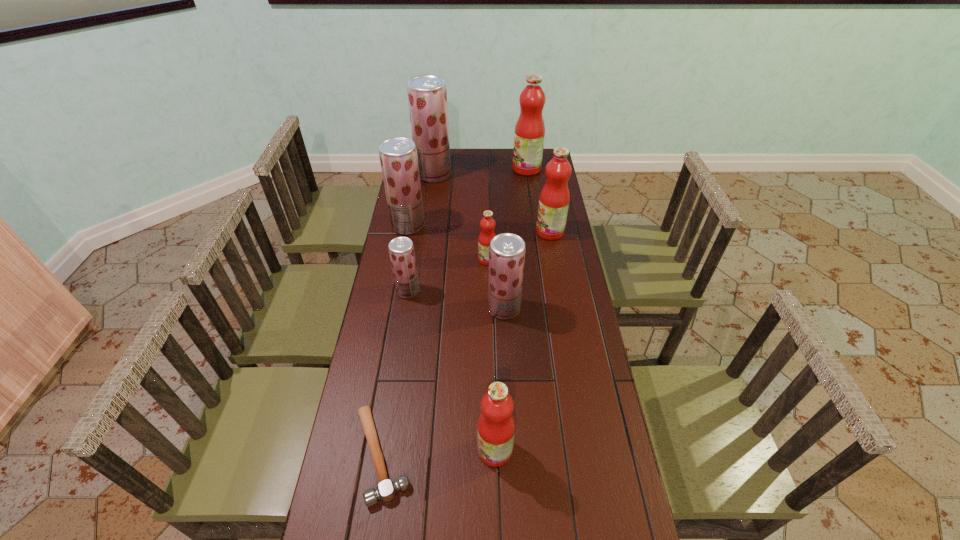
Where is `the farthest pink fruit juice`? The height and width of the screenshot is (540, 960). the farthest pink fruit juice is located at coordinates (529, 134).

This screenshot has height=540, width=960. What are the coordinates of `the farthest strawberry fruit juice` in the screenshot? It's located at (427, 94).

Find the location of a particular element. the second farthest pink fruit juice is located at coordinates (554, 199).

Identify the location of the third nearest strawberry fruit juice. Image resolution: width=960 pixels, height=540 pixels. (398, 156).

Find the location of a particular element. The width and height of the screenshot is (960, 540). the third biggest strawberry fruit juice is located at coordinates (507, 251).

This screenshot has width=960, height=540. Find the location of `the third biggest pink fruit juice`. the third biggest pink fruit juice is located at coordinates (496, 427).

What are the coordinates of `the nearest pink fruit juice` in the screenshot? It's located at (496, 427).

You are a GUI agent. You are given a task and a screenshot of the screen. Output one action in this format:
    pyautogui.click(x=<x>, y=<y>)
    Task: Click on the fourth nearest fruit juice
    
    Given the screenshot: What is the action you would take?
    pyautogui.click(x=487, y=224)

Identify the location of the smallest pink fruit juice. The height and width of the screenshot is (540, 960). (487, 224).

This screenshot has height=540, width=960. In order to click on the smallest strawberry fruit juice in this screenshot , I will do `click(401, 249)`.